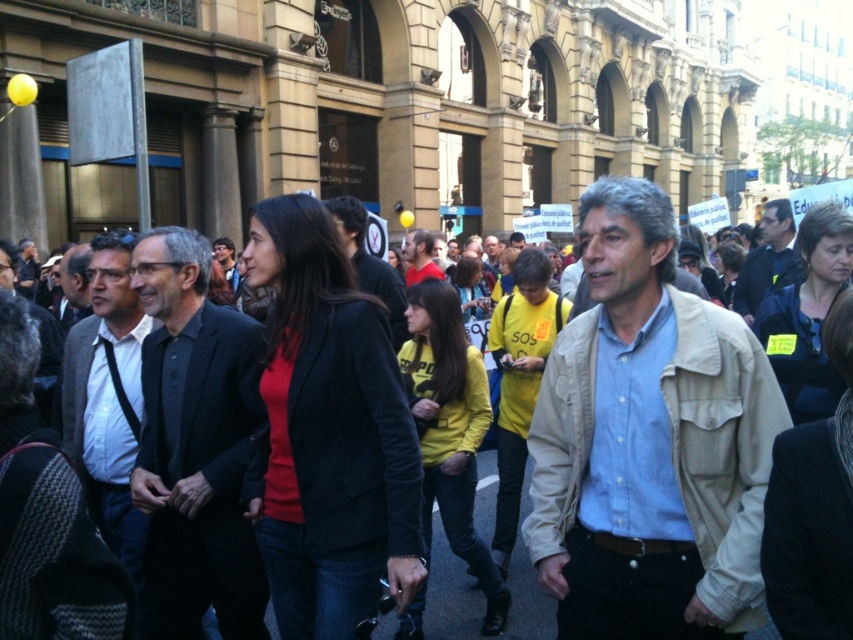
You are a photographer trying to capture a photo of the matte red shirt at center without including the dark gray suit at left in the frame. Based on their positions, is this possible?

The dark gray suit at left might be wider than matte red shirt at center, so there is a possibility that the dark gray suit at left could block the view of the matte red shirt at center. To ensure the matte red shirt at center is visible without the dark gray suit at left, the photographer should adjust their angle or position to avoid the potential overlap.

You are a photographer standing at the back of the crowd. You want to take a photo that includes both the beige textured jacket at center and the dark gray suit at left. Given that your camera has a maximum focus range of 50 feet, will you be able to capture both subjects in focus?

The distance between the beige textured jacket at center and the dark gray suit at left is 45.93 feet, which is within the camera maximum focus range of 50 feet. Therefore, you can capture both subjects in focus.

You are standing at the center of the street in the lively scene. There are two points marked in the image, one at coordinates point (648, 531) and another at point (134, 349). Which of these two points is closer to your current position?

Point (648, 531) is closer to the camera than point (134, 349), so the point at coordinates point (648, 531) is closer to your current position.